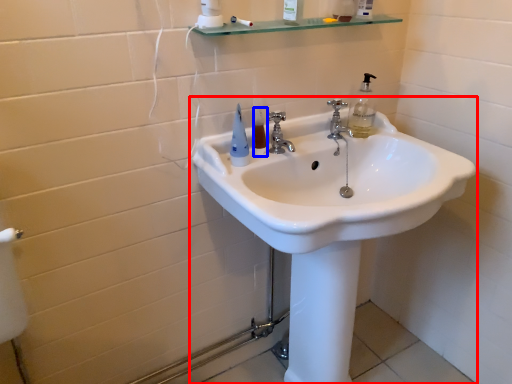
Question: Which object appears farthest to the camera in this image, sink (highlighted by a red box) or mouthwash (highlighted by a blue box)?

Choices:
 (A) sink
 (B) mouthwash

Answer: (B)